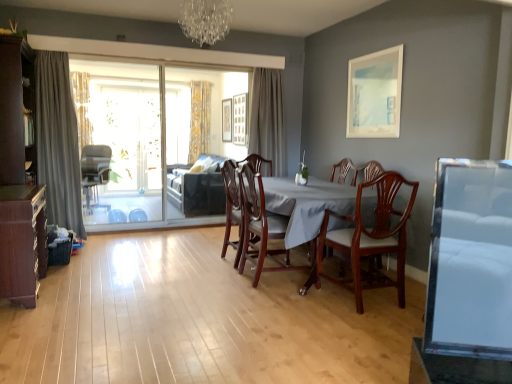
The width and height of the screenshot is (512, 384). Describe the element at coordinates (129, 132) in the screenshot. I see `transparent glass sliding door at center` at that location.

Locate an element on the screen. This screenshot has height=384, width=512. dark gray fabric couch at center is located at coordinates (197, 189).

Measure the distance between white matte picture frame at upper right, the 1th picture frame viewed from the right, and camera.

The depth of white matte picture frame at upper right, the 1th picture frame viewed from the right, is 3.74 meters.

How much space does white matte picture frame at upper right, the 1th picture frame viewed from the right, occupy vertically?

31.64 inches.

Describe the element at coordinates (155, 142) in the screenshot. I see `transparent glass screen door at left` at that location.

Find the location of a particular element. gray fabric curtain at left, which appears as the 4th curtain when viewed from the back is located at coordinates (58, 141).

In order to click on the 2nd chair in front of the matte gray chair at left, which ranks as the fourth chair in front-to-back order, starting your count from the anchor in this screenshot , I will do `click(260, 225)`.

Based on the photo, is matte gray chair at left, the first chair when ordered from left to right, not inside mahogany wood dining chair at center, the 2th chair from the front?

matte gray chair at left, the first chair when ordered from left to right, is positioned outside mahogany wood dining chair at center, the 2th chair from the front.

Which of these two, matte gray chair at left, the first chair when ordered from left to right, or mahogany wood dining chair at center, which is counted as the 3th chair, starting from the back, stands taller?

With more height is mahogany wood dining chair at center, which is counted as the 3th chair, starting from the back.

Between matte gray chair at left, the first chair when ordered from left to right, and mahogany wood dining chair at center, marked as the second chair in a right-to-left arrangement, which one has larger size?

matte gray chair at left, the first chair when ordered from left to right, is bigger.

Is yellow floral fabric curtain at upper center, the first curtain viewed from the back, turned away from white matte picture frame at upper right, the 1th picture frame viewed from the right?

No, yellow floral fabric curtain at upper center, the first curtain viewed from the back,'s orientation is not away from white matte picture frame at upper right, the 1th picture frame viewed from the right.

From a real-world perspective, is yellow floral fabric curtain at upper center, the 3th curtain in the left-to-right sequence, physically located above or below white matte picture frame at upper right, acting as the third picture frame starting from the left?

In terms of real-world spatial position, yellow floral fabric curtain at upper center, the 3th curtain in the left-to-right sequence, is below white matte picture frame at upper right, acting as the third picture frame starting from the left.

Is yellow floral fabric curtain at upper center, the 3th curtain in the left-to-right sequence, directly adjacent to white matte picture frame at upper right, the 1th picture frame viewed from the right?

No, yellow floral fabric curtain at upper center, the 3th curtain in the left-to-right sequence, is not with white matte picture frame at upper right, the 1th picture frame viewed from the right.

Considering the relative sizes of yellow floral fabric curtain at upper center, the first curtain viewed from the back, and white matte picture frame at upper right, acting as the third picture frame starting from the left, in the image provided, is yellow floral fabric curtain at upper center, the first curtain viewed from the back, taller than white matte picture frame at upper right, acting as the third picture frame starting from the left,?

Yes.

Starting from the mahogany wood chair at center, the first chair positioned from the front, which curtain is the 1st one to the left? Please provide its 2D coordinates.

[(268, 120)]

From a real-world perspective, is mahogany wood chair at center, which is the 4th chair from back to front, under gray fabric curtain at center, the 4th curtain when ordered from left to right?

Yes, from a real-world perspective, mahogany wood chair at center, which is the 4th chair from back to front, is below gray fabric curtain at center, the 4th curtain when ordered from left to right.

Is mahogany wood chair at center, the first chair positioned from the front, directly adjacent to gray fabric curtain at center, the 4th curtain when ordered from left to right?

mahogany wood chair at center, the first chair positioned from the front, and gray fabric curtain at center, the 4th curtain when ordered from left to right, are clearly separated.

Is point (398, 212) positioned in front of point (259, 143)?

Yes.

Is wooden picture frame at upper center, the first picture frame from the back, next to transparent glass sliding door at center?

They are not placed beside each other.

From a real-world perspective, is wooden picture frame at upper center, the 1th picture frame in the left-to-right sequence, positioned over transparent glass sliding door at center based on gravity?

Yes, from a real-world perspective, wooden picture frame at upper center, the 1th picture frame in the left-to-right sequence, is above transparent glass sliding door at center.

Is point (222, 119) positioned in front of point (130, 190)?

No, it is not.

Can you confirm if matte gray chair at left, which is the fourth chair from right to left, is positioned to the left of silky beige curtain at left, which appears as the second curtain when viewed from the back?

In fact, matte gray chair at left, which is the fourth chair from right to left, is to the right of silky beige curtain at left, which appears as the second curtain when viewed from the back.

Between matte gray chair at left, the 1th chair in the back-to-front sequence, and silky beige curtain at left, the first curtain from the left, which one has larger width?

matte gray chair at left, the 1th chair in the back-to-front sequence.

Is matte gray chair at left, the first chair when ordered from left to right, positioned with its back to silky beige curtain at left, acting as the 3th curtain starting from the front?

No, matte gray chair at left, the first chair when ordered from left to right, is not facing away from silky beige curtain at left, acting as the 3th curtain starting from the front.

Can you confirm if matte gray chair at left, which ranks as the fourth chair in front-to-back order, is smaller than silky beige curtain at left, acting as the 4th curtain starting from the right?

Actually, matte gray chair at left, which ranks as the fourth chair in front-to-back order, might be larger than silky beige curtain at left, acting as the 4th curtain starting from the right.

Does wooden cabinet at lower left have a lesser height compared to mahogany wood table at center?

Yes, wooden cabinet at lower left is shorter than mahogany wood table at center.

Looking at the image, does wooden cabinet at lower left seem bigger or smaller compared to mahogany wood table at center?

wooden cabinet at lower left is smaller than mahogany wood table at center.

Considering the positions of objects wooden cabinet at lower left and mahogany wood table at center in the image provided, who is more to the right, wooden cabinet at lower left or mahogany wood table at center?

From the viewer's perspective, mahogany wood table at center appears more on the right side.

Who is more distant, wooden cabinet at lower left or mahogany wood table at center?

mahogany wood table at center is further away from the camera.

From the image's perspective, does transparent glass sliding door at center appear lower than yellow floral fabric curtain at upper center, the 4th curtain when ordered from front to back?

Indeed, from the image's perspective, transparent glass sliding door at center is shown beneath yellow floral fabric curtain at upper center, the 4th curtain when ordered from front to back.

What are the coordinates of `window that appears below the yellow floral fabric curtain at upper center, the first curtain viewed from the back (from the image's perspective)` in the screenshot? It's located at (129, 132).

In terms of height, does transparent glass sliding door at center look taller or shorter compared to yellow floral fabric curtain at upper center, the 4th curtain when ordered from front to back?

Clearly, transparent glass sliding door at center is taller compared to yellow floral fabric curtain at upper center, the 4th curtain when ordered from front to back.

The height and width of the screenshot is (384, 512). In order to click on chair that is the 2nd object to the right of the matte gray chair at left, the 1th chair in the back-to-front sequence, starting at the anchor in this screenshot , I will do `click(260, 225)`.

This screenshot has width=512, height=384. There is a yellow floral fabric curtain at upper center, the first curtain viewed from the back. What are the coordinates of `the 3rd picture frame below it (from the image's perspective)` in the screenshot? It's located at (375, 94).

When comparing their distances from wooden cabinet at lower left, does mahogany wood dining chair at center, the 3th chair in the left-to-right sequence, or crystal glass chandelier at upper center seem further?

crystal glass chandelier at upper center.

Based on their spatial positions, is matte gray chair at left, which ranks as the fourth chair in front-to-back order, or white matte picture frame at upper right, acting as the third picture frame starting from the left, further from yellow floral fabric curtain at upper center, the 3th curtain in the left-to-right sequence?

The object further to yellow floral fabric curtain at upper center, the 3th curtain in the left-to-right sequence, is white matte picture frame at upper right, acting as the third picture frame starting from the left.

From the picture: Which object lies further to the anchor point dark gray fabric couch at center, transparent glass screen door at left or gray fabric curtain at center, which appears as the first curtain when viewed from the right?

gray fabric curtain at center, which appears as the first curtain when viewed from the right.

From the image, which object appears to be farther from wooden cabinet at lower left, mahogany wood chair at center, the first chair when ordered from right to left, or white matte picture frame at upper right, the 1th picture frame viewed from the right?

Among the two, white matte picture frame at upper right, the 1th picture frame viewed from the right, is located further to wooden cabinet at lower left.

Estimate the real-world distances between objects in this image. Which object is further from matte gray chair at left, which ranks as the fourth chair in front-to-back order, gray fabric curtain at left, positioned as the 2th curtain in left-to-right order, or white matte picture frame at upper right, acting as the third picture frame starting from the left?

Answer: Based on the image, white matte picture frame at upper right, acting as the third picture frame starting from the left, appears to be further to matte gray chair at left, which ranks as the fourth chair in front-to-back order.

Consider the image. Estimate the real-world distances between objects in this image. Which object is further from wooden picture frame at upper center, the first picture frame from the back, gray fabric curtain at left, the 3th curtain from the right, or white matte picture frame at upper right, acting as the third picture frame starting from the left?

white matte picture frame at upper right, acting as the third picture frame starting from the left, is positioned further to the anchor wooden picture frame at upper center, the first picture frame from the back.

When comparing their distances from yellow floral fabric curtain at upper center, which ranks as the 2th curtain in right-to-left order, does silky beige curtain at left, the first curtain from the left, or gray fabric curtain at center, which is counted as the 3th curtain, starting from the back, seem further?

The object further to yellow floral fabric curtain at upper center, which ranks as the 2th curtain in right-to-left order, is silky beige curtain at left, the first curtain from the left.

Looking at the image, which one is located further to wooden picture frame at upper center, the 3th picture frame when ordered from right to left, mahogany wood chair at center, which is the fourth chair from left to right, or silky beige curtain at left, acting as the 3th curtain starting from the front?

Among the two, mahogany wood chair at center, which is the fourth chair from left to right, is located further to wooden picture frame at upper center, the 3th picture frame when ordered from right to left.

Where is `screen door between matte gray chair at left, the 1th chair in the back-to-front sequence, and white matte picture frame at upper right, the third picture frame when ordered from back to front, from left to right`? screen door between matte gray chair at left, the 1th chair in the back-to-front sequence, and white matte picture frame at upper right, the third picture frame when ordered from back to front, from left to right is located at coordinates (155, 142).

I want to click on window positioned between transparent glass screen door at left and yellow floral fabric curtain at upper center, the 4th curtain when ordered from front to back, from near to far, so click(x=129, y=132).

Locate an element on the screen. The height and width of the screenshot is (384, 512). screen door between gray fabric curtain at left, which appears as the 4th curtain when viewed from the back, and silky beige curtain at left, acting as the 3th curtain starting from the front, in the front-back direction is located at coordinates (155, 142).

At what (x,y) coordinates should I click in order to perform the action: click on chair located between mahogany wood chair at center, which is counted as the third chair, starting from the right, and silky beige curtain at left, acting as the 3th curtain starting from the front, in the depth direction. Please return your answer as a coordinate pair (x, y). Looking at the image, I should click on (95, 171).